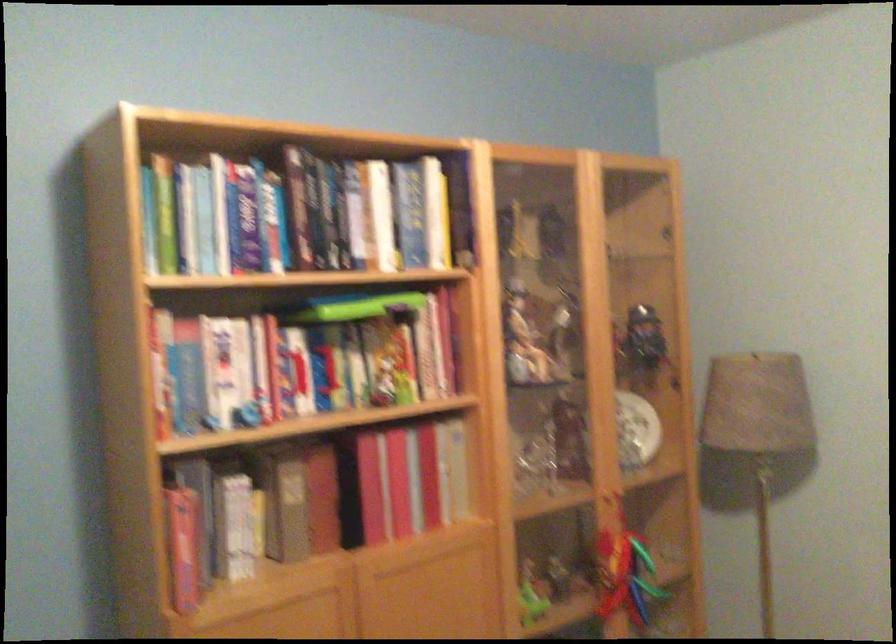
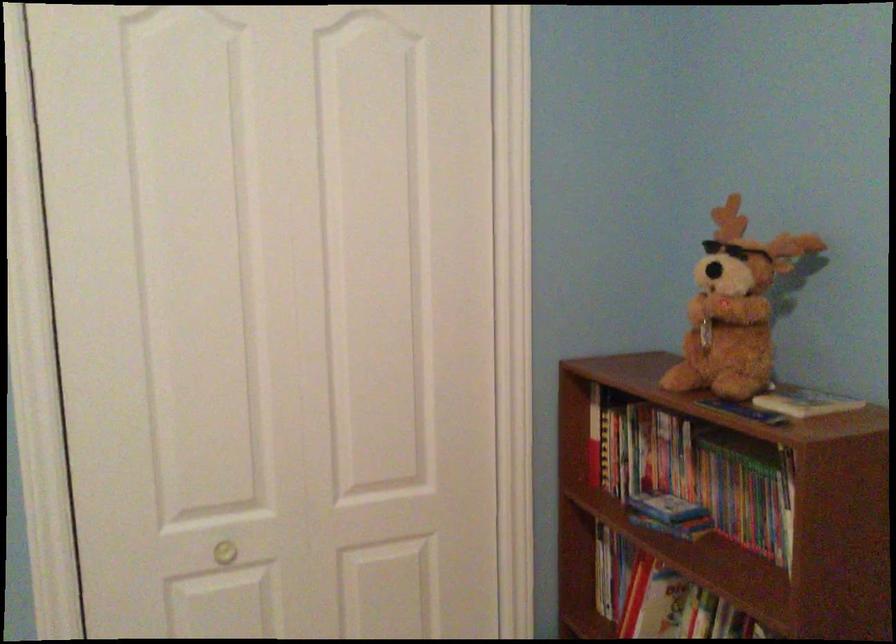
Question: The camera is either moving clockwise (left) or counter-clockwise (right) around the object. The first image is from the beginning of the video and the second image is from the end. Is the camera moving left or right when shooting the video?

Choices:
 (A) Left
 (B) Right

Answer: (B)